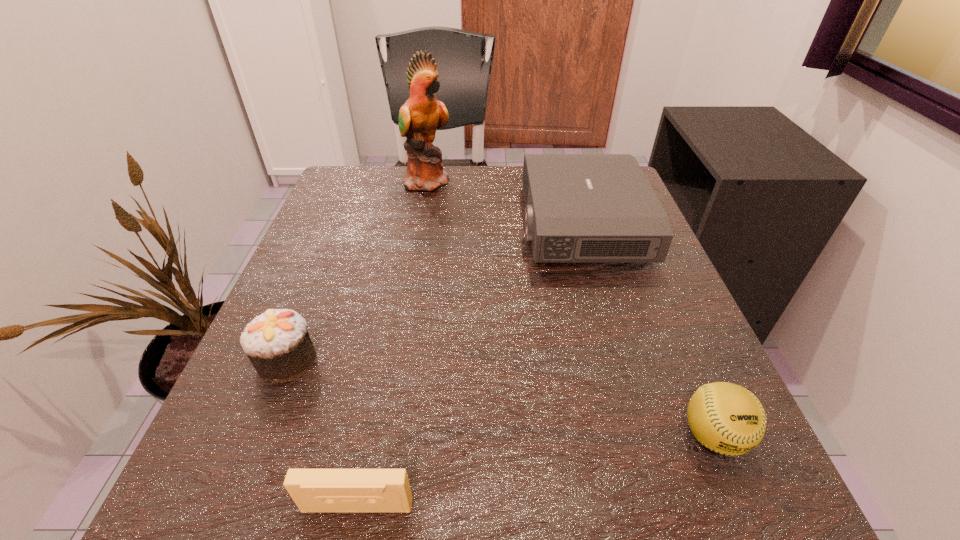
At what (x,y) coordinates should I click in order to perform the action: click on vacant region located on the front-facing side of the projector. Please return your answer as a coordinate pair (x, y). Looking at the image, I should click on (499, 225).

Find the location of a particular element. This screenshot has width=960, height=540. vacant space located 0.180m on the front of the leftmost object is located at coordinates (225, 514).

Find the location of a particular element. parrot located at the far edge is located at coordinates (420, 116).

Find the location of a particular element. projector located at the far edge is located at coordinates tap(579, 207).

This screenshot has height=540, width=960. What are the coordinates of `softball that is positioned at the near edge` in the screenshot? It's located at (726, 418).

Where is `videotape located in the near edge section of the desktop`? videotape located in the near edge section of the desktop is located at coordinates (313, 490).

Where is `cupcake located at the left edge`? The width and height of the screenshot is (960, 540). cupcake located at the left edge is located at coordinates (277, 343).

What are the coordinates of `videotape located at the left edge` in the screenshot? It's located at (313, 490).

At what (x,y) coordinates should I click in order to perform the action: click on projector located in the right edge section of the desktop. Please return your answer as a coordinate pair (x, y). The image size is (960, 540). Looking at the image, I should click on (579, 207).

Where is `softball located in the right edge section of the desktop`? The image size is (960, 540). softball located in the right edge section of the desktop is located at coordinates (726, 418).